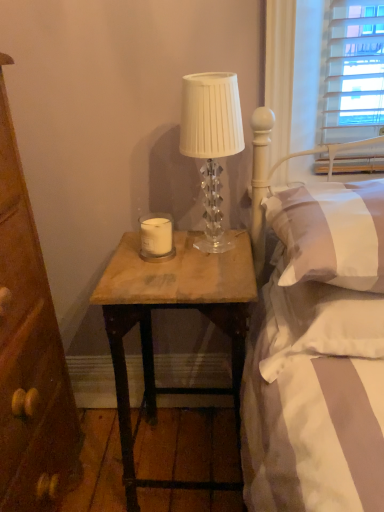
Question: Considering the relative positions of white soft pillow at right, the 2th pillow in the top-to-bottom sequence, and white soft pillow at upper right, the first pillow when ordered from top to bottom, in the image provided, is white soft pillow at right, the 2th pillow in the top-to-bottom sequence, to the left of white soft pillow at upper right, the first pillow when ordered from top to bottom, from the viewer's perspective?

Choices:
 (A) no
 (B) yes

Answer: (B)

Question: Can you confirm if white soft pillow at right, the 2th pillow in the top-to-bottom sequence, is smaller than white soft pillow at upper right, the first pillow when ordered from top to bottom?

Choices:
 (A) yes
 (B) no

Answer: (A)

Question: From a real-world perspective, is white soft pillow at right, the 2th pillow in the top-to-bottom sequence, physically below white soft pillow at upper right, the first pillow when ordered from top to bottom?

Choices:
 (A) yes
 (B) no

Answer: (A)

Question: Is the depth of white soft pillow at right, the 2th pillow in the top-to-bottom sequence, greater than that of white soft pillow at upper right, the first pillow when ordered from top to bottom?

Choices:
 (A) no
 (B) yes

Answer: (B)

Question: Can you confirm if white soft pillow at right, the 1th pillow positioned from the bottom, is taller than white soft pillow at upper right, which is the 2th pillow from bottom to top?

Choices:
 (A) yes
 (B) no

Answer: (B)

Question: Considering the positions of white matte candle at center and white soft pillow at upper right, the first pillow when ordered from top to bottom, in the image, is white matte candle at center wider or thinner than white soft pillow at upper right, the first pillow when ordered from top to bottom,?

Choices:
 (A) thin
 (B) wide

Answer: (A)

Question: Based on their sizes in the image, would you say white matte candle at center is bigger or smaller than white soft pillow at upper right, the first pillow when ordered from top to bottom?

Choices:
 (A) big
 (B) small

Answer: (B)

Question: Considering the relative positions of white matte candle at center and white soft pillow at upper right, the first pillow when ordered from top to bottom, in the image provided, is white matte candle at center to the left or to the right of white soft pillow at upper right, the first pillow when ordered from top to bottom,?

Choices:
 (A) left
 (B) right

Answer: (A)

Question: Considering the positions of point [162, 218] and point [316, 245], is point [162, 218] closer or farther from the camera than point [316, 245]?

Choices:
 (A) farther
 (B) closer

Answer: (A)

Question: Would you say white matte candle at center is inside or outside clear crystal lamp at upper center?

Choices:
 (A) outside
 (B) inside

Answer: (A)

Question: Considering the positions of white matte candle at center and clear crystal lamp at upper center in the image, is white matte candle at center taller or shorter than clear crystal lamp at upper center?

Choices:
 (A) short
 (B) tall

Answer: (A)

Question: Looking at their shapes, would you say white matte candle at center is wider or thinner than clear crystal lamp at upper center?

Choices:
 (A) thin
 (B) wide

Answer: (A)

Question: Considering the positions of white matte candle at center and clear crystal lamp at upper center in the image, is white matte candle at center bigger or smaller than clear crystal lamp at upper center?

Choices:
 (A) small
 (B) big

Answer: (A)

Question: Considering the positions of wooden table at center and white matte candle at center in the image, is wooden table at center wider or thinner than white matte candle at center?

Choices:
 (A) wide
 (B) thin

Answer: (A)

Question: In terms of height, does wooden table at center look taller or shorter compared to white matte candle at center?

Choices:
 (A) tall
 (B) short

Answer: (A)